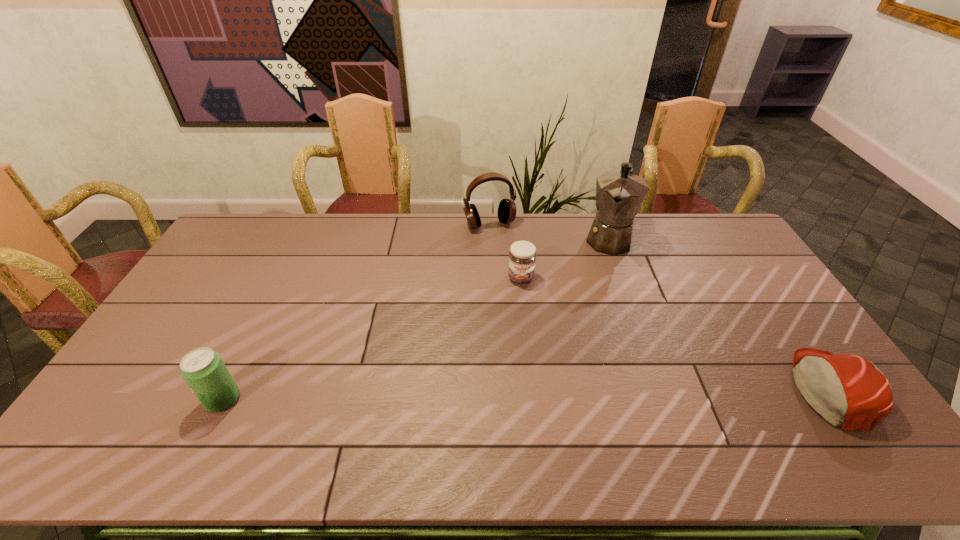
Where is `vacant area that satisfies the following two spatial constraints: 1. on the front side of the second object from right to left; 2. on the front-facing side of the rightmost object`? vacant area that satisfies the following two spatial constraints: 1. on the front side of the second object from right to left; 2. on the front-facing side of the rightmost object is located at coordinates (661, 389).